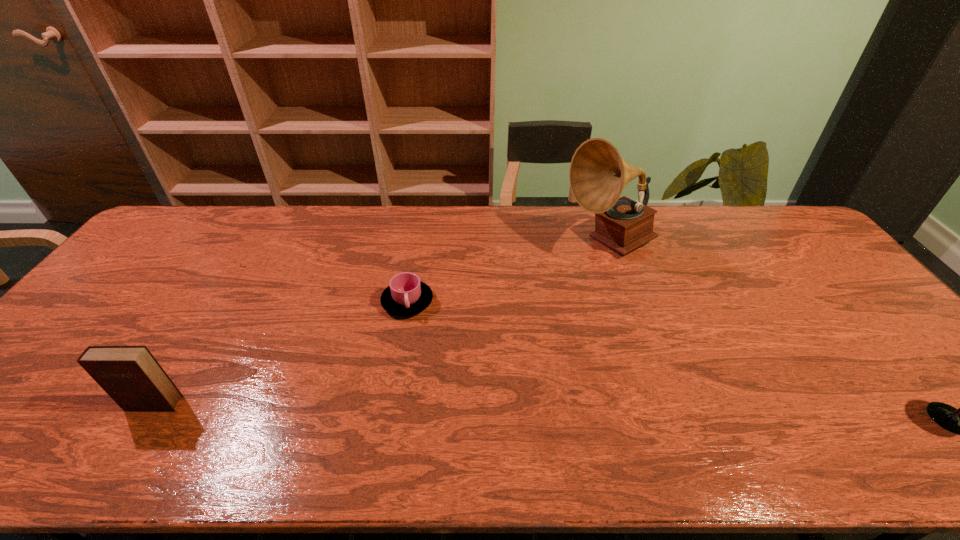
The width and height of the screenshot is (960, 540). I want to click on vacant area between the farthest object and the diary, so click(x=381, y=323).

Find the location of a particular element. The height and width of the screenshot is (540, 960). object that stands as the second closest to the wineglass is located at coordinates (406, 295).

Identify which object is the third nearest to the cup. Please provide its 2D coordinates. Your answer should be formatted as a tuple, i.e. [(x, y)], where the tuple contains the x and y coordinates of a point satisfying the conditions above.

[(959, 421)]

At what (x,y) coordinates should I click in order to perform the action: click on vacant area that satisfies the following two spatial constraints: 1. on the back side of the third object from left to right; 2. on the left side of the shortest object. Please return your answer as a coordinate pair (x, y). Looking at the image, I should click on (418, 243).